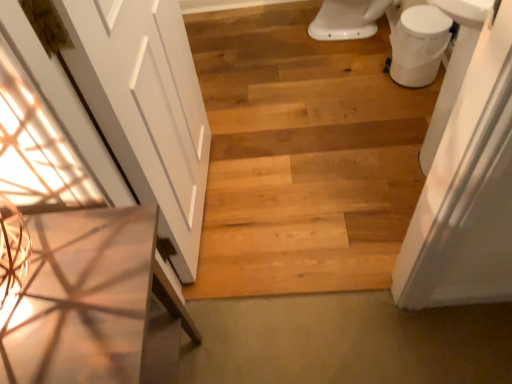
Question: From a real-world perspective, is natural wood plank at center on top of white matte door at left?

Choices:
 (A) no
 (B) yes

Answer: (A)

Question: Is natural wood plank at center oriented towards white matte door at left?

Choices:
 (A) yes
 (B) no

Answer: (B)

Question: From a real-world perspective, is natural wood plank at center located beneath white matte door at left?

Choices:
 (A) yes
 (B) no

Answer: (A)

Question: Does natural wood plank at center have a lesser height compared to white matte door at left?

Choices:
 (A) no
 (B) yes

Answer: (B)

Question: Can you confirm if natural wood plank at center is wider than white matte door at left?

Choices:
 (A) yes
 (B) no

Answer: (B)

Question: Would you say white matte door at left is inside or outside white glossy toilet bowl at upper right?

Choices:
 (A) outside
 (B) inside

Answer: (A)

Question: From the image's perspective, is white matte door at left positioned above or below white glossy toilet bowl at upper right?

Choices:
 (A) above
 (B) below

Answer: (B)

Question: Considering the positions of white matte door at left and white glossy toilet bowl at upper right in the image, is white matte door at left taller or shorter than white glossy toilet bowl at upper right?

Choices:
 (A) tall
 (B) short

Answer: (A)

Question: In terms of size, does white matte door at left appear bigger or smaller than white glossy toilet bowl at upper right?

Choices:
 (A) big
 (B) small

Answer: (A)

Question: Looking at their shapes, would you say wooden table at left is wider or thinner than white glossy toilet bowl at upper right?

Choices:
 (A) thin
 (B) wide

Answer: (B)

Question: From a real-world perspective, is wooden table at left positioned above or below white glossy toilet bowl at upper right?

Choices:
 (A) below
 (B) above

Answer: (B)

Question: Is wooden table at left spatially inside white glossy toilet bowl at upper right, or outside of it?

Choices:
 (A) outside
 (B) inside

Answer: (A)

Question: In terms of height, does wooden table at left look taller or shorter compared to white glossy toilet bowl at upper right?

Choices:
 (A) tall
 (B) short

Answer: (A)

Question: From the image's perspective, is white glossy toilet bowl at upper right positioned above or below wooden table at left?

Choices:
 (A) above
 (B) below

Answer: (A)

Question: Considering the positions of white glossy toilet bowl at upper right and wooden table at left in the image, is white glossy toilet bowl at upper right wider or thinner than wooden table at left?

Choices:
 (A) wide
 (B) thin

Answer: (B)